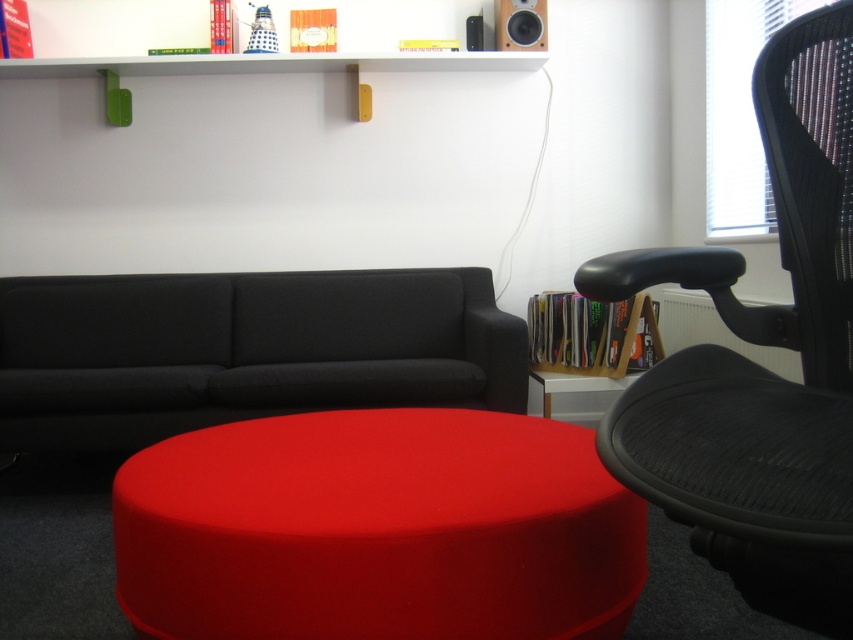
Does dark gray fabric couch at center appear over white glossy side table at lower center?

Yes.

Is point (223, 410) closer to viewer compared to point (576, 388)?

Yes, point (223, 410) is closer to viewer.

Find the location of `dark gray fabric couch at center`. dark gray fabric couch at center is located at coordinates (242, 349).

Is black mesh swivel chair at right shorter than dark gray fabric couch at center?

No.

Is the position of black mesh swivel chair at right more distant than that of dark gray fabric couch at center?

No, black mesh swivel chair at right is closer to the viewer.

Is point (827, 160) positioned in front of point (346, 316)?

Yes, point (827, 160) is closer to viewer.

At what (x,y) coordinates should I click in order to perform the action: click on black mesh swivel chair at right. Please return your answer as a coordinate pair (x, y). Looking at the image, I should click on (758, 364).

Does black mesh swivel chair at right have a lesser width compared to matte black speaker at upper center?

In fact, black mesh swivel chair at right might be wider than matte black speaker at upper center.

Which is in front, point (842, 237) or point (518, 36)?

Point (842, 237) is more forward.

Locate an element on the screen. black mesh swivel chair at right is located at coordinates (758, 364).